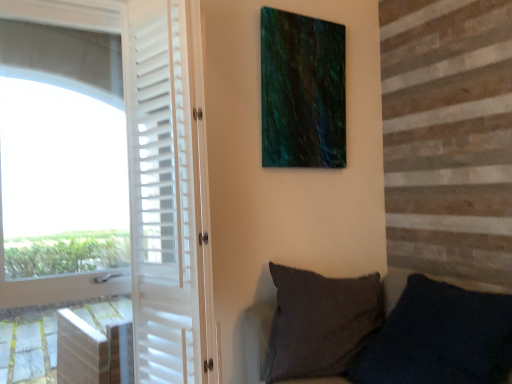
Question: Is the position of dark gray fabric pillow at lower right more distant than that of white matte screen door at left?

Choices:
 (A) no
 (B) yes

Answer: (A)

Question: Could you tell me if dark gray fabric pillow at lower right is turned towards white matte screen door at left?

Choices:
 (A) yes
 (B) no

Answer: (B)

Question: Does dark gray fabric pillow at lower right have a lesser height compared to white matte screen door at left?

Choices:
 (A) yes
 (B) no

Answer: (A)

Question: From a real-world perspective, does dark gray fabric pillow at lower right sit lower than white matte screen door at left?

Choices:
 (A) no
 (B) yes

Answer: (B)

Question: Are dark gray fabric pillow at lower right and white matte screen door at left located far from each other?

Choices:
 (A) no
 (B) yes

Answer: (A)

Question: Considering the positions of point (62, 8) and point (137, 36), is point (62, 8) closer or farther from the camera than point (137, 36)?

Choices:
 (A) closer
 (B) farther

Answer: (A)

Question: From the image's perspective, is white matte door at left positioned above or below white matte screen door at left?

Choices:
 (A) below
 (B) above

Answer: (A)

Question: Considering the positions of white matte door at left and white matte screen door at left in the image, is white matte door at left taller or shorter than white matte screen door at left?

Choices:
 (A) tall
 (B) short

Answer: (A)

Question: Choose the correct answer: Is white matte door at left inside white matte screen door at left or outside it?

Choices:
 (A) outside
 (B) inside

Answer: (A)

Question: Considering the positions of dark gray fabric pillow at lower right and white matte door at left in the image, is dark gray fabric pillow at lower right bigger or smaller than white matte door at left?

Choices:
 (A) small
 (B) big

Answer: (A)

Question: Does point click(402, 314) appear closer or farther from the camera than point click(199, 148)?

Choices:
 (A) farther
 (B) closer

Answer: (A)

Question: Relative to white matte door at left, is dark gray fabric pillow at lower right in front or behind?

Choices:
 (A) front
 (B) behind

Answer: (A)

Question: In terms of height, does dark gray fabric pillow at lower right look taller or shorter compared to white matte door at left?

Choices:
 (A) short
 (B) tall

Answer: (A)

Question: Is point (1, 1) closer or farther from the camera than point (493, 372)?

Choices:
 (A) farther
 (B) closer

Answer: (A)

Question: In the image, is white matte door at left on the left side or the right side of dark gray fabric pillow at lower right?

Choices:
 (A) left
 (B) right

Answer: (A)